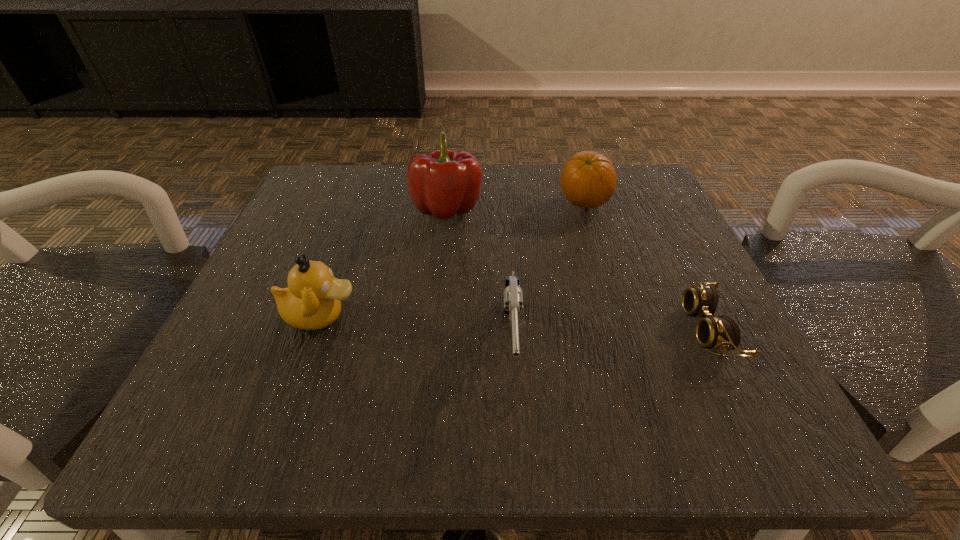
Locate an element on the screen. The height and width of the screenshot is (540, 960). the second object from left to right is located at coordinates (442, 183).

Locate an element on the screen. the leftmost object is located at coordinates (312, 301).

The image size is (960, 540). In order to click on orange in this screenshot , I will do `click(588, 180)`.

This screenshot has height=540, width=960. What are the coordinates of `the third object from right to left` in the screenshot? It's located at (513, 295).

Where is `the rightmost object`? The height and width of the screenshot is (540, 960). the rightmost object is located at coordinates (722, 332).

Find the location of `the shortest object`. the shortest object is located at coordinates (722, 332).

The width and height of the screenshot is (960, 540). Identify the location of free location located 0.140m on the front of the pepper. (440, 282).

Find the location of a particular element. This screenshot has height=540, width=960. vacant space located on the face of the duckling is located at coordinates (523, 315).

Where is `blank area located on the back of the fourth object from left to right`? The image size is (960, 540). blank area located on the back of the fourth object from left to right is located at coordinates (575, 174).

Where is `vacant region located 0.310m through the lenses of the rightmost object`? The height and width of the screenshot is (540, 960). vacant region located 0.310m through the lenses of the rightmost object is located at coordinates (477, 329).